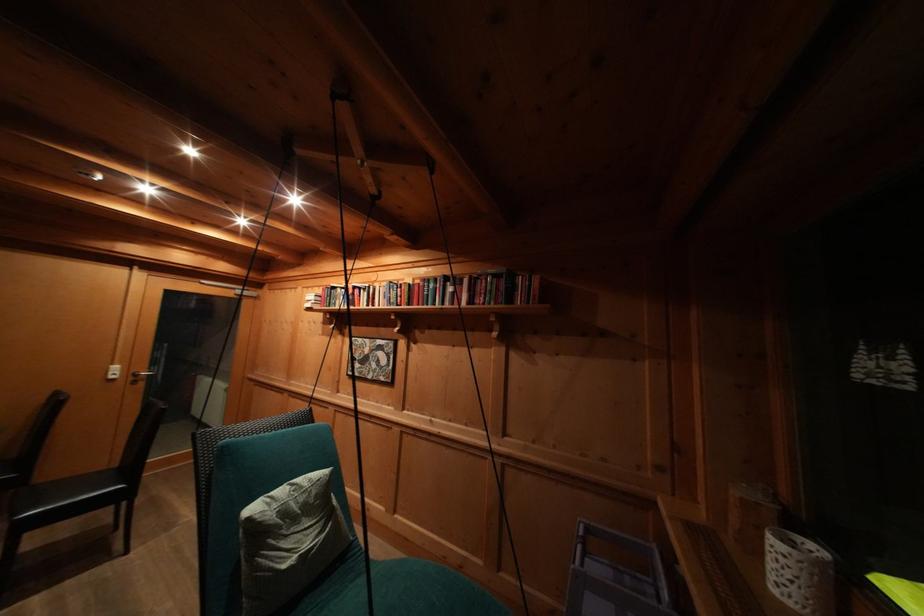
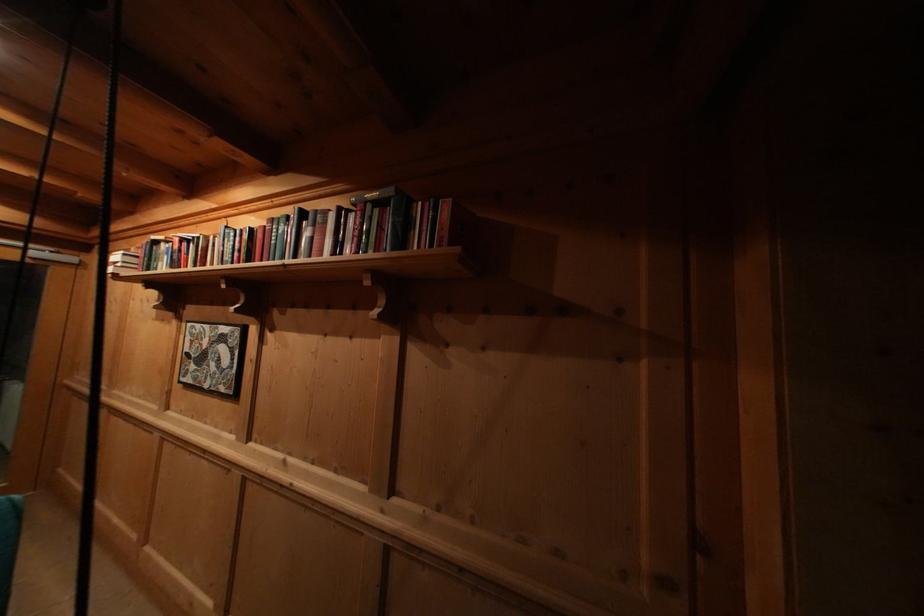
In a continuous first-person perspective shot, in which direction is the camera moving?

The movement direction of the cameraman is right, forward.